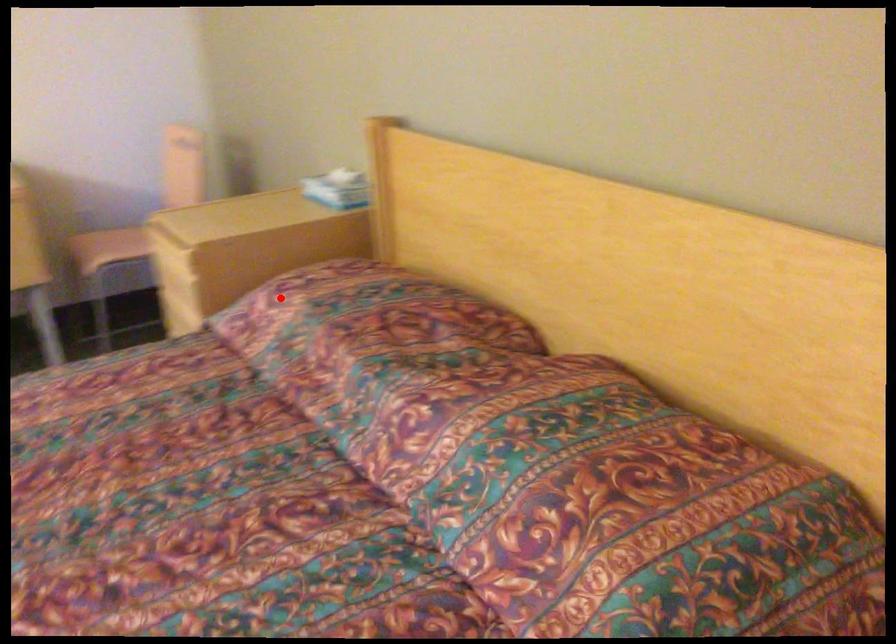
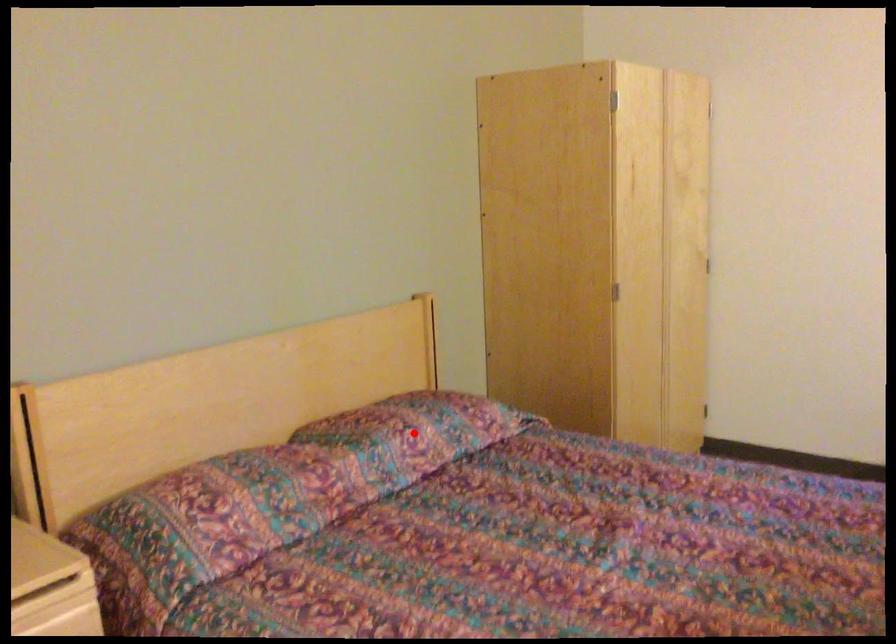
I am providing you with two images of the same scene from different viewpoints. A red point is marked on the first image and another point is marked on the second image. Are the points marked in image1 and image2 representing the same 3D position?

No